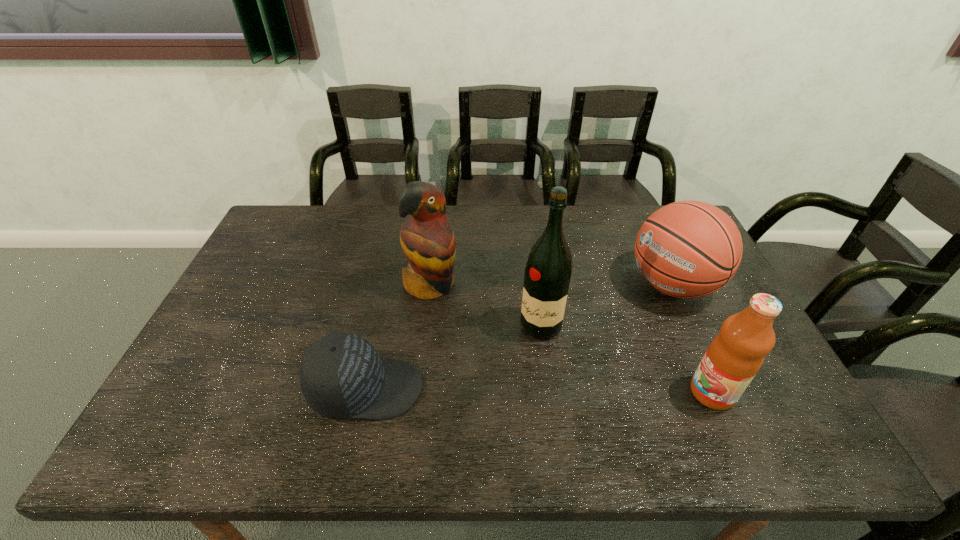
Find the location of `vacant area situated on the front-facing side of the liquor`. vacant area situated on the front-facing side of the liquor is located at coordinates (511, 368).

Find the location of a particular element. This screenshot has height=540, width=960. vacant region located on the front-facing side of the liquor is located at coordinates (516, 360).

The height and width of the screenshot is (540, 960). Find the location of `blank space located on the logo side of the basketball`. blank space located on the logo side of the basketball is located at coordinates [581, 338].

Identify the location of free spot located on the logo side of the basketball. The image size is (960, 540). (546, 357).

The width and height of the screenshot is (960, 540). In order to click on vacant space situated on the logo side of the basketball in this screenshot , I will do `click(602, 326)`.

Where is `vacant space located 0.120m on the face of the parrot`? The width and height of the screenshot is (960, 540). vacant space located 0.120m on the face of the parrot is located at coordinates (467, 326).

Find the location of a particular element. free space located 0.090m on the face of the parrot is located at coordinates (461, 320).

Locate an element on the screen. Image resolution: width=960 pixels, height=540 pixels. free spot located 0.060m on the face of the parrot is located at coordinates (456, 313).

Identify the location of baseball cap situated at the near edge. The height and width of the screenshot is (540, 960). (341, 375).

Identify the location of fruit juice at the near edge. Image resolution: width=960 pixels, height=540 pixels. (734, 357).